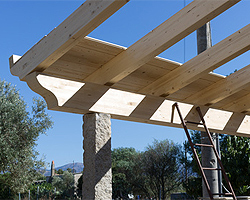
Locate an element on the screen. The height and width of the screenshot is (200, 250). wooden beams is located at coordinates (69, 26), (198, 65), (228, 88), (236, 105), (144, 110), (151, 47).